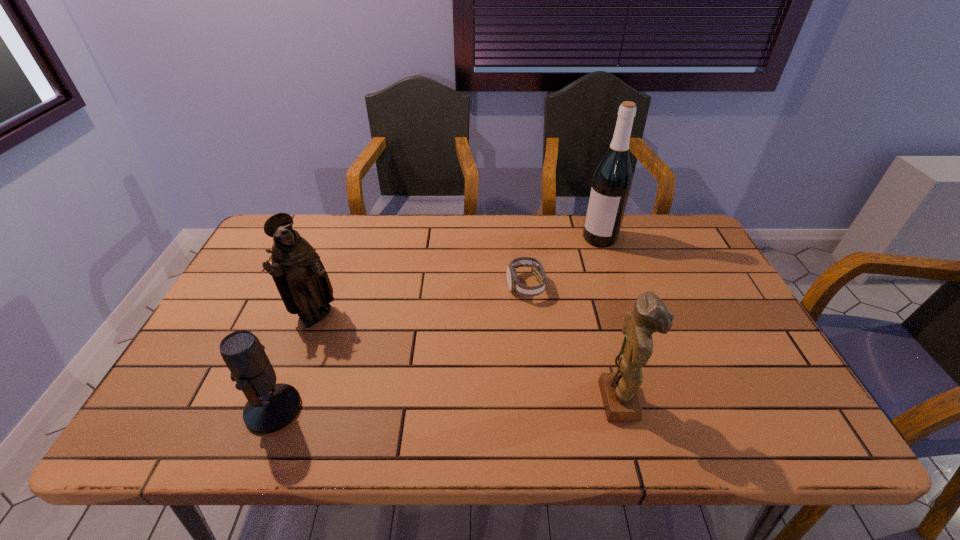
The width and height of the screenshot is (960, 540). Identify the location of vacant space that satisfies the following two spatial constraints: 1. on the front side of the second farthest object; 2. on the front-facing side of the nearer figurine. pyautogui.click(x=538, y=401).

Find the location of a particular element. The image size is (960, 540). vacant space that satisfies the following two spatial constraints: 1. on the front side of the right figurine; 2. on the front-facing side of the shortest object is located at coordinates (538, 401).